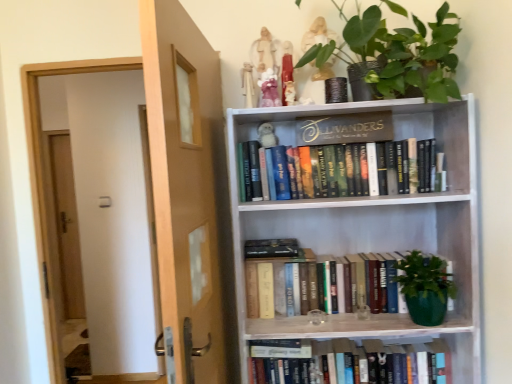
The height and width of the screenshot is (384, 512). What are the coordinates of `free point above hardcover books at center, marked as the 1th book in a top-to-bottom arrangement (from a real-world perspective)` in the screenshot? It's located at (333, 136).